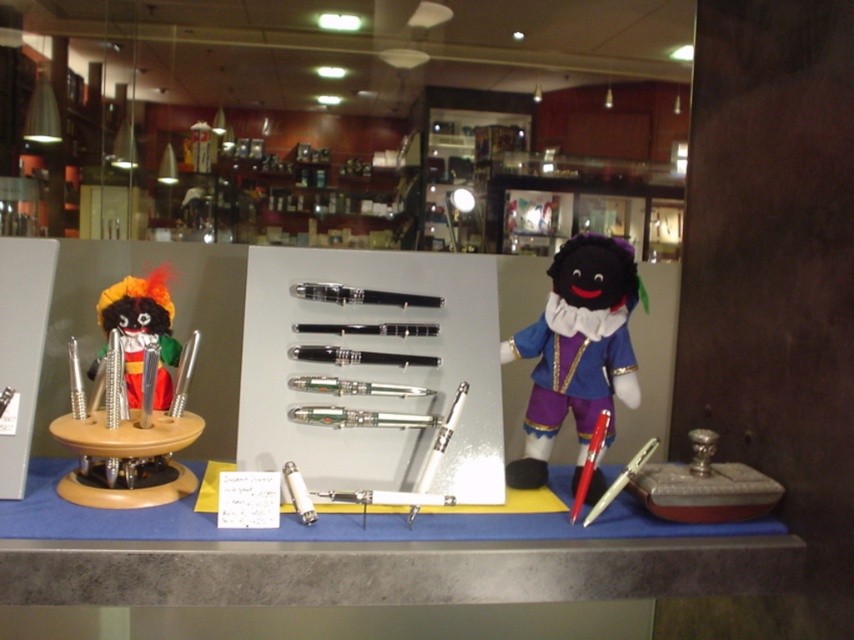
Question: Is wooden toy at left bigger than velvet doll at center?

Choices:
 (A) no
 (B) yes

Answer: (B)

Question: Considering the real-world distances, which object is farthest from the velvet doll at center?

Choices:
 (A) black glossy pen at center
 (B) wooden toy at left
 (C) blue fabric table at center

Answer: (B)

Question: Is wooden toy at left further to the viewer compared to velvet doll at center?

Choices:
 (A) yes
 (B) no

Answer: (B)

Question: Among these points, which one is farthest from the camera?

Choices:
 (A) (586, 628)
 (B) (576, 404)

Answer: (A)

Question: Can you confirm if wooden toy at left is smaller than velvet doll at center?

Choices:
 (A) no
 (B) yes

Answer: (A)

Question: Estimate the real-world distances between objects in this image. Which object is closer to the velvet doll at center?

Choices:
 (A) black glossy pen at center
 (B) wooden toy at left

Answer: (A)